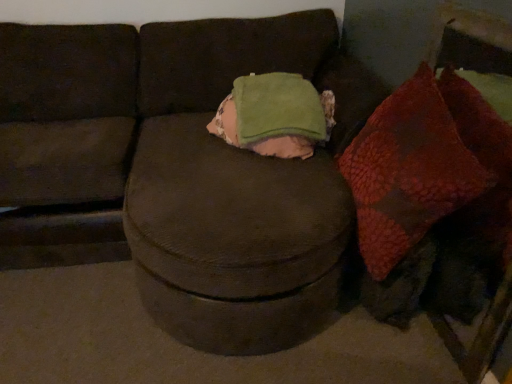
Question: Is leather-like brown dog at lower right positioned in front of green fleece throw pillow at center?

Choices:
 (A) no
 (B) yes

Answer: (B)

Question: Could you tell me if leather-like brown dog at lower right is facing green fleece throw pillow at center?

Choices:
 (A) yes
 (B) no

Answer: (B)

Question: Is leather-like brown dog at lower right in contact with green fleece throw pillow at center?

Choices:
 (A) no
 (B) yes

Answer: (A)

Question: Is leather-like brown dog at lower right at the left side of green fleece throw pillow at center?

Choices:
 (A) yes
 (B) no

Answer: (B)

Question: From a real-world perspective, is leather-like brown dog at lower right under green fleece throw pillow at center?

Choices:
 (A) no
 (B) yes

Answer: (B)

Question: Considering the positions of point (256, 97) and point (371, 278), is point (256, 97) closer or farther from the camera than point (371, 278)?

Choices:
 (A) closer
 (B) farther

Answer: (B)

Question: Is green fleece throw pillow at center bigger or smaller than leather-like brown dog at lower right?

Choices:
 (A) small
 (B) big

Answer: (B)

Question: From the image's perspective, is green fleece throw pillow at center above or below leather-like brown dog at lower right?

Choices:
 (A) below
 (B) above

Answer: (B)

Question: Visually, is green fleece throw pillow at center positioned to the left or to the right of leather-like brown dog at lower right?

Choices:
 (A) left
 (B) right

Answer: (A)

Question: Looking at the image, does textured red bean bag at right seem bigger or smaller compared to green fleece throw pillow at center?

Choices:
 (A) small
 (B) big

Answer: (B)

Question: Does point (448, 157) appear closer or farther from the camera than point (321, 127)?

Choices:
 (A) farther
 (B) closer

Answer: (B)

Question: Is textured red bean bag at right spatially inside green fleece throw pillow at center, or outside of it?

Choices:
 (A) inside
 (B) outside

Answer: (B)

Question: From their relative heights in the image, would you say textured red bean bag at right is taller or shorter than green fleece throw pillow at center?

Choices:
 (A) tall
 (B) short

Answer: (A)

Question: Is leather-like brown dog at lower right bigger or smaller than textured red bean bag at right?

Choices:
 (A) big
 (B) small

Answer: (B)

Question: From a real-world perspective, is leather-like brown dog at lower right positioned above or below textured red bean bag at right?

Choices:
 (A) above
 (B) below

Answer: (B)